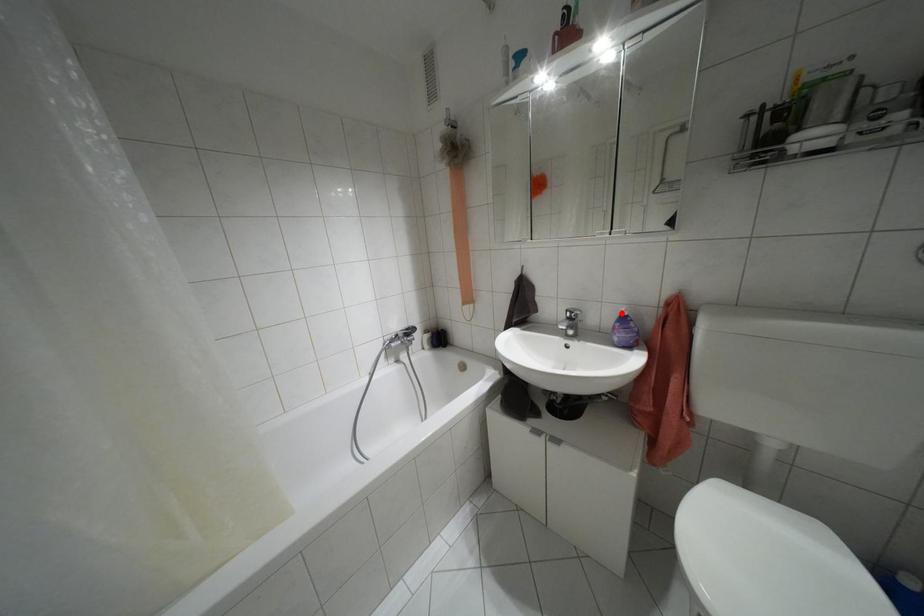
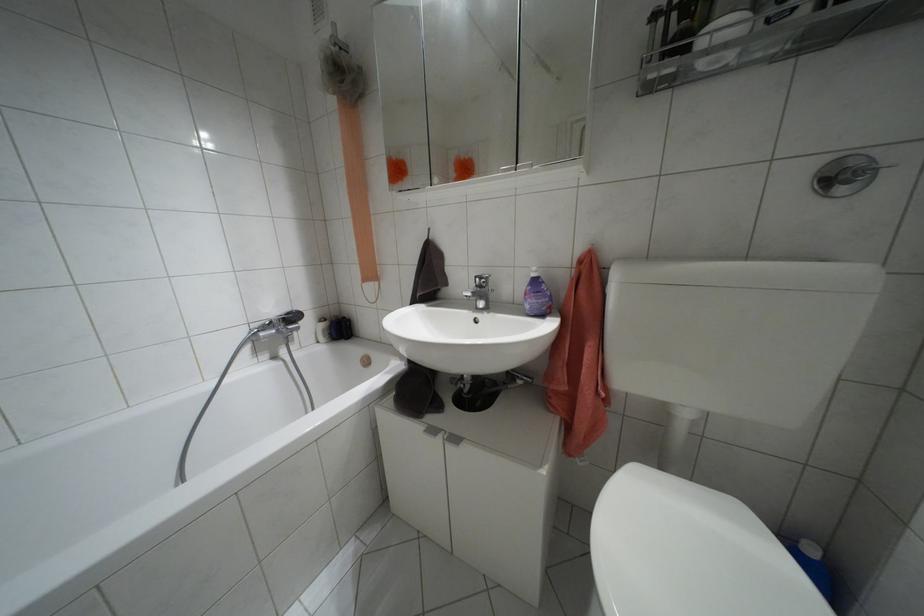
The point at the highlighted location is marked in the first image. Where is the corresponding point in the second image?

(532, 274)